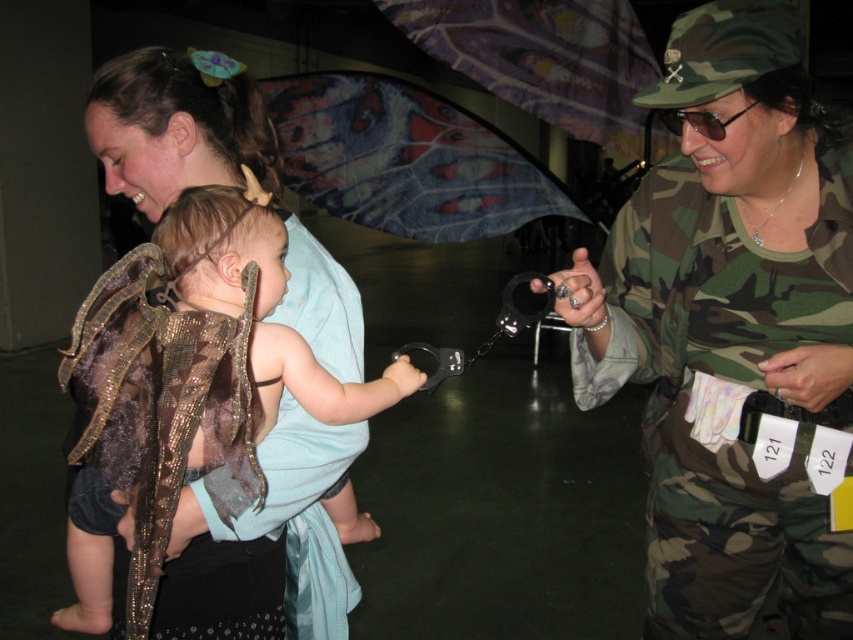
Question: Does matte gold wings at upper left have a smaller size compared to camouflage fabric baby carrier at center?

Choices:
 (A) no
 (B) yes

Answer: (A)

Question: Is matte gold wings at upper left to the left of camouflage fabric baby carrier at center from the viewer's perspective?

Choices:
 (A) yes
 (B) no

Answer: (A)

Question: Which of these objects is positioned closest to the camouflage uniform at center?

Choices:
 (A) matte gold wings at upper left
 (B) camouflage fabric baby carrier at center

Answer: (B)

Question: Which of the following is the closest to the observer?

Choices:
 (A) matte gold wings at upper left
 (B) camouflage uniform at center

Answer: (B)

Question: Is camouflage uniform at center closer to camera compared to matte gold wings at upper left?

Choices:
 (A) no
 (B) yes

Answer: (B)

Question: Which object is the closest to the camouflage uniform at center?

Choices:
 (A) camouflage fabric baby carrier at center
 (B) matte gold wings at upper left

Answer: (A)